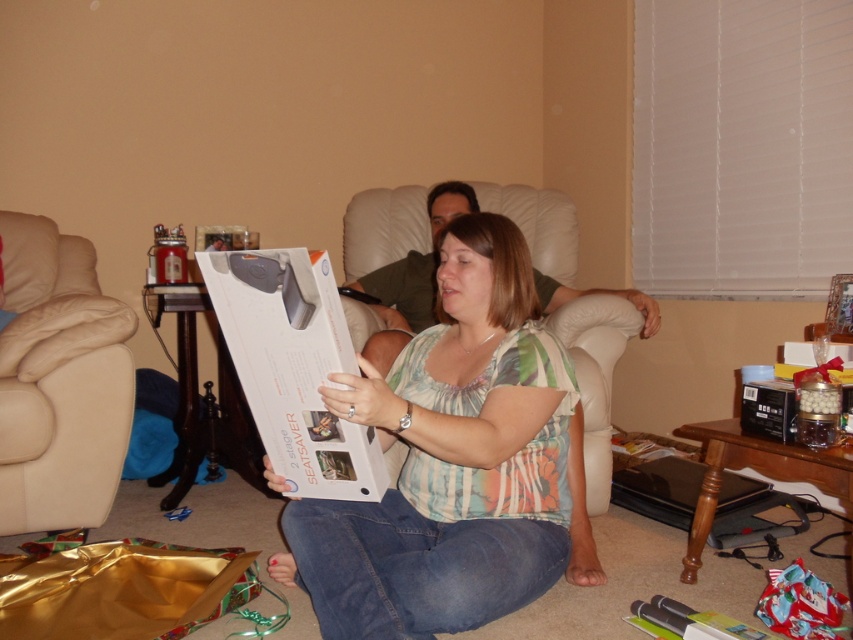
From the picture: Does white leather armchair at center come in front of white cardboard box at center?

No, white leather armchair at center is behind white cardboard box at center.

Is point (386, 307) positioned before point (305, 467)?

No, it is not.

Is point (590, 500) farther from viewer compared to point (265, 348)?

That is True.

You are a GUI agent. You are given a task and a screenshot of the screen. Output one action in this format:
    pyautogui.click(x=<x>, y=<y>)
    Task: Click on the white leather armchair at center
    
    Given the screenshot: What is the action you would take?
    pyautogui.click(x=431, y=250)

Is white paperboard box at center positioned before white leather armchair at center?

Yes, it is in front of white leather armchair at center.

Between white paperboard box at center and white leather armchair at center, which one is positioned higher?

white leather armchair at center

Does point (410, 374) come farther from viewer compared to point (422, 275)?

No.

Locate an element on the screen. The width and height of the screenshot is (853, 640). white paperboard box at center is located at coordinates (456, 464).

Which of these two, white paperboard box at center or white cardboard box at center, stands shorter?

white cardboard box at center

Is white paperboard box at center positioned behind white cardboard box at center?

Yes, it is behind white cardboard box at center.

Is point (450, 305) positioned in front of point (305, 276)?

No.

At what (x,y) coordinates should I click in order to perform the action: click on white paperboard box at center. Please return your answer as a coordinate pair (x, y). The height and width of the screenshot is (640, 853). Looking at the image, I should click on (456, 464).